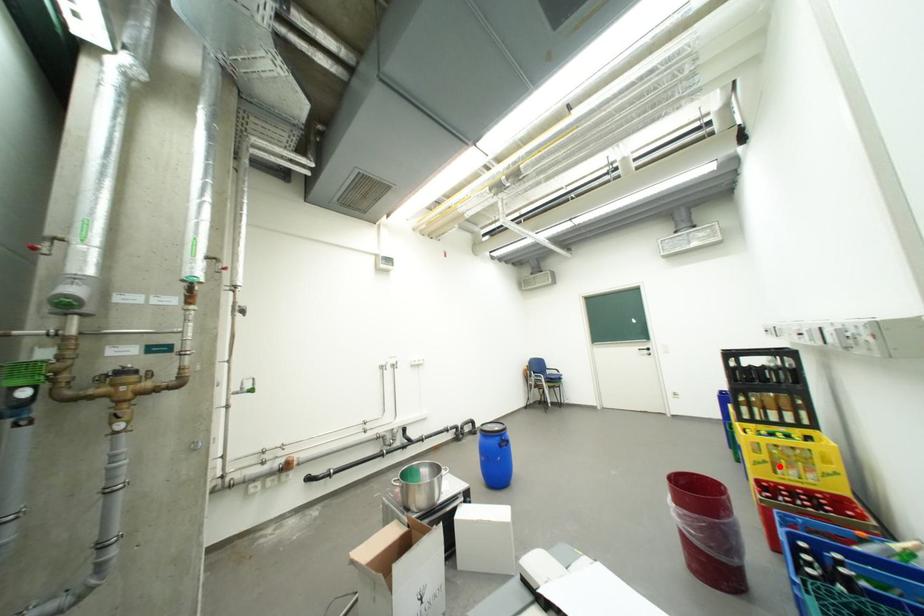
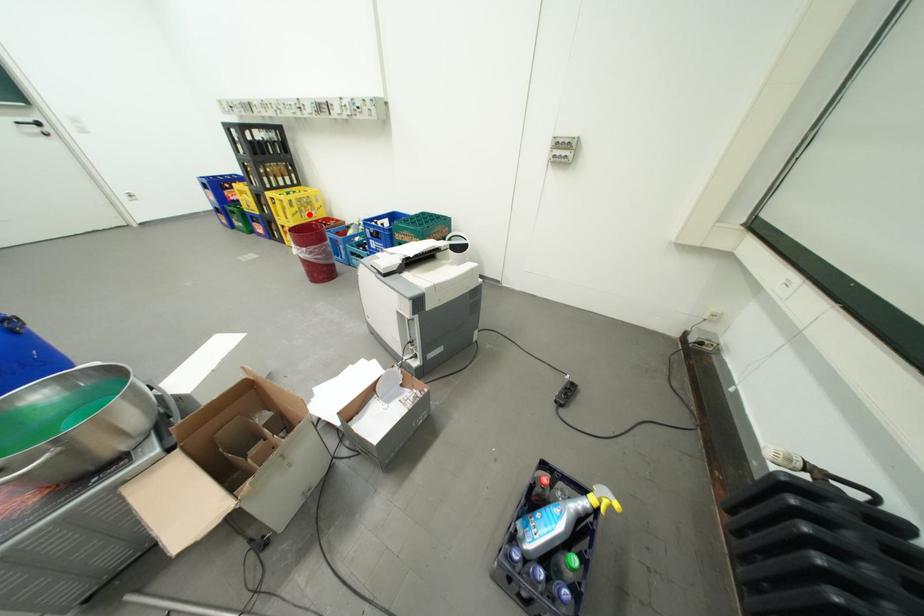
I am providing you with two images of the same scene from different viewpoints. A red point is marked on the first image and another point is marked on the second image. Is the marked point in image1 the same physical position as the marked point in image2?

Yes